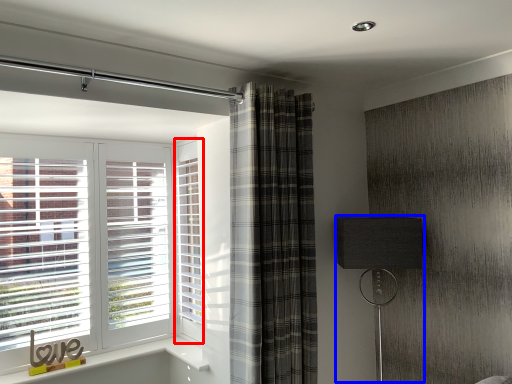
Question: Which of the following is the farthest to the observer, screen door (highlighted by a red box) or table lamp (highlighted by a blue box)?

Choices:
 (A) screen door
 (B) table lamp

Answer: (A)